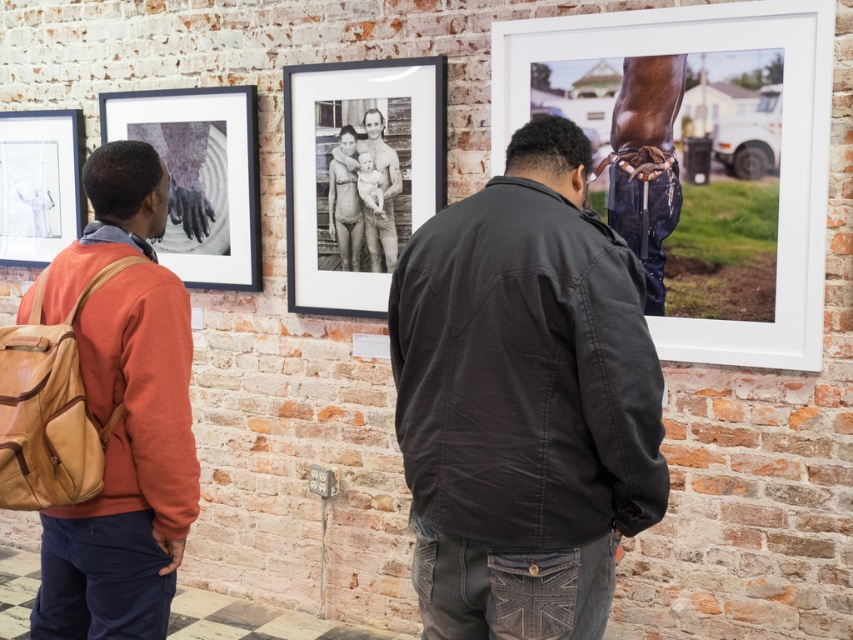
Question: Which is nearer to the dark gray jacket at center?

Choices:
 (A) matte glass picture frame at upper left
 (B) white matte picture frame at right

Answer: (B)

Question: Which of these objects is positioned farthest from the matte glass picture frame at upper left?

Choices:
 (A) black matte photo frame at center
 (B) white matte picture frame at right
 (C) dark gray jacket at center

Answer: (C)

Question: Is matte black frame at upper left smaller than matte glass picture frame at upper left?

Choices:
 (A) yes
 (B) no

Answer: (B)

Question: Can you confirm if matte black frame at upper left is positioned below matte glass picture frame at upper left?

Choices:
 (A) yes
 (B) no

Answer: (B)

Question: Is white matte picture frame at right to the left of matte black frame at upper left from the viewer's perspective?

Choices:
 (A) yes
 (B) no

Answer: (B)

Question: Considering the real-world distances, which object is farthest from the white matte picture frame at right?

Choices:
 (A) matte black frame at upper left
 (B) dark gray jacket at center

Answer: (A)